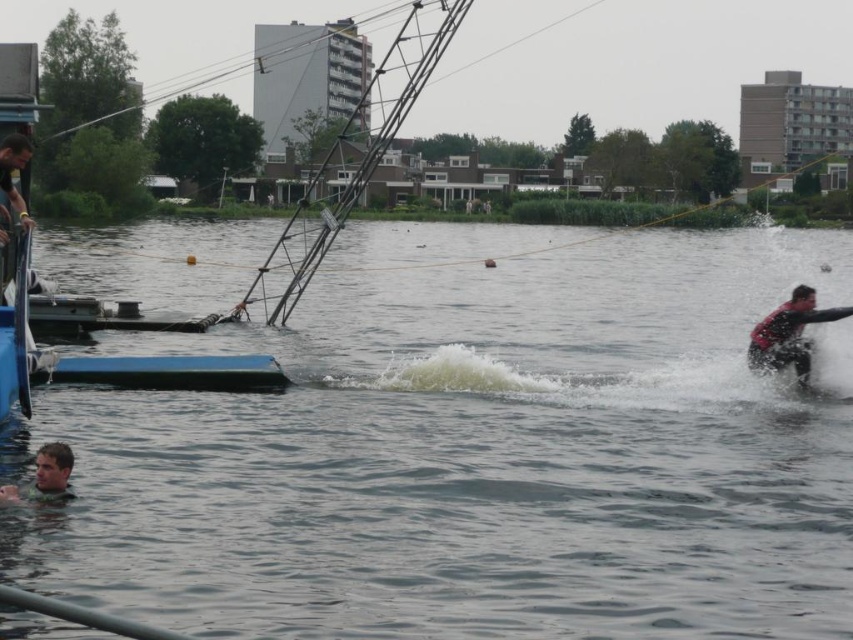
Question: Which object is closer to the camera taking this photo?

Choices:
 (A) blue plastic boat at left
 (B) clear water at lower left
 (C) red matte life vest at right

Answer: (B)

Question: Which point is farther to the camera?

Choices:
 (A) clear water at lower left
 (B) blue plastic boat at left

Answer: (B)

Question: Which object is the closest to the clear water at lower left?

Choices:
 (A) red matte life vest at right
 (B) blue plastic boat at left
 (C) smooth skin head at lower left

Answer: (B)

Question: Is blue plastic boat at left positioned behind red matte life vest at right?

Choices:
 (A) yes
 (B) no

Answer: (B)

Question: Is clear water at lower left smaller than smooth skin head at lower left?

Choices:
 (A) no
 (B) yes

Answer: (A)

Question: Does blue plastic boat at left appear under red matte life vest at right?

Choices:
 (A) no
 (B) yes

Answer: (A)